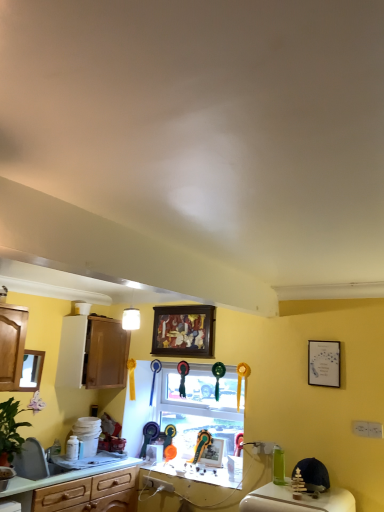
Question: Can you confirm if white glossy countertop at center is wider than white matte picture frame at upper right, the fourth picture frame in the back-to-front sequence?

Choices:
 (A) yes
 (B) no

Answer: (A)

Question: Is white glossy countertop at center thinner than white matte picture frame at upper right, the fourth picture frame from the left?

Choices:
 (A) no
 (B) yes

Answer: (A)

Question: From the image's perspective, would you say white glossy countertop at center is shown under white matte picture frame at upper right, the fourth picture frame in the back-to-front sequence?

Choices:
 (A) no
 (B) yes

Answer: (B)

Question: Does white glossy countertop at center come behind white matte picture frame at upper right, which is counted as the 2th picture frame, starting from the top?

Choices:
 (A) no
 (B) yes

Answer: (B)

Question: Could you tell me if white glossy countertop at center is turned towards white matte picture frame at upper right, the first picture frame from the front?

Choices:
 (A) yes
 (B) no

Answer: (B)

Question: Can you confirm if white glossy countertop at center is positioned to the right of white matte picture frame at upper right, which is counted as the 2th picture frame, starting from the top?

Choices:
 (A) yes
 (B) no

Answer: (B)

Question: Can you confirm if wooden mirror at left, which is the 3th picture frame from back to front, is thinner than white glossy countertop at center?

Choices:
 (A) yes
 (B) no

Answer: (A)

Question: From a real-world perspective, is wooden mirror at left, which is the 3th picture frame from back to front, below white glossy countertop at center?

Choices:
 (A) no
 (B) yes

Answer: (A)

Question: Is wooden mirror at left, the second picture frame viewed from the front, behind white glossy countertop at center?

Choices:
 (A) no
 (B) yes

Answer: (B)

Question: Does wooden mirror at left, which appears as the 3th picture frame when viewed from the top, lie in front of white glossy countertop at center?

Choices:
 (A) yes
 (B) no

Answer: (B)

Question: Does wooden mirror at left, which is the 3th picture frame from back to front, have a smaller size compared to white glossy countertop at center?

Choices:
 (A) yes
 (B) no

Answer: (A)

Question: Is the surface of wooden mirror at left, placed as the first picture frame when sorted from left to right, in direct contact with white glossy countertop at center?

Choices:
 (A) no
 (B) yes

Answer: (A)

Question: Does green laminate countertop at lower left contain white glossy countertop at center?

Choices:
 (A) no
 (B) yes

Answer: (A)